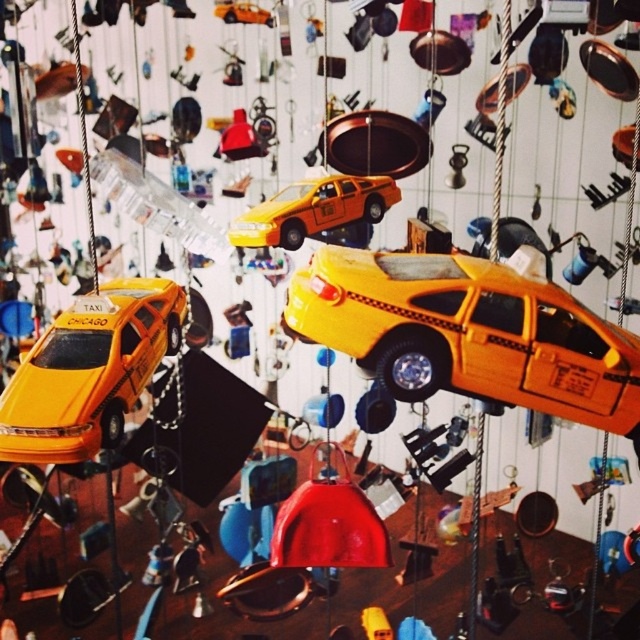
Does point (369, 289) come in front of point (285, 198)?

Yes.

Can you confirm if yellow matte taxi at center is smaller than matte yellow toy car at center?

Actually, yellow matte taxi at center might be larger than matte yellow toy car at center.

Does point (404, 332) come closer to viewer compared to point (256, 241)?

Yes, point (404, 332) is closer to viewer.

Locate an element on the screen. This screenshot has width=640, height=640. yellow matte taxi at center is located at coordinates (467, 333).

Is yellow matte taxi at center below matte yellow toy car at left?

Yes.

Which is in front, point (308, 324) or point (97, 417)?

Positioned in front is point (308, 324).

Where is `yellow matte taxi at center`? This screenshot has width=640, height=640. yellow matte taxi at center is located at coordinates (467, 333).

Is matte yellow toy car at left positioned in front of matte yellow toy car at center?

Yes, it is in front of matte yellow toy car at center.

Which is in front, point (42, 339) or point (332, 211)?

Point (42, 339)

Between point (115, 323) and point (257, 234), which one is positioned in front?

Point (115, 323)

At what (x,y) coordinates should I click in order to perform the action: click on matte yellow toy car at left. Please return your answer as a coordinate pair (x, y). This screenshot has width=640, height=640. Looking at the image, I should click on (90, 371).